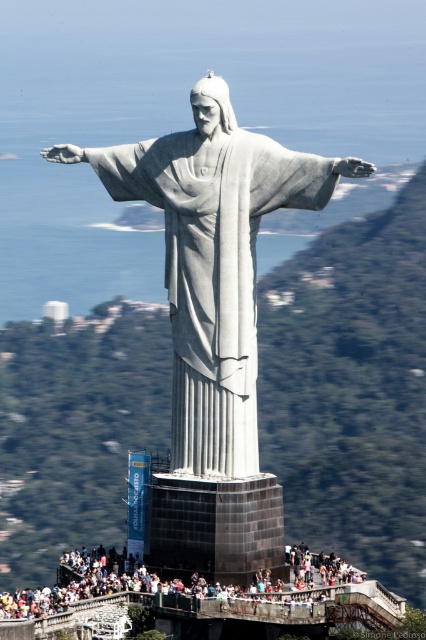
Is white marble statue at center wider than matte gray statue at center?

No.

Between white marble statue at center and matte gray statue at center, which one has less height?

Standing shorter between the two is matte gray statue at center.

Who is more forward, (141, 189) or (227, 605)?

Point (227, 605) is in front.

Identify the location of white marble statue at center. This screenshot has width=426, height=640. (213, 260).